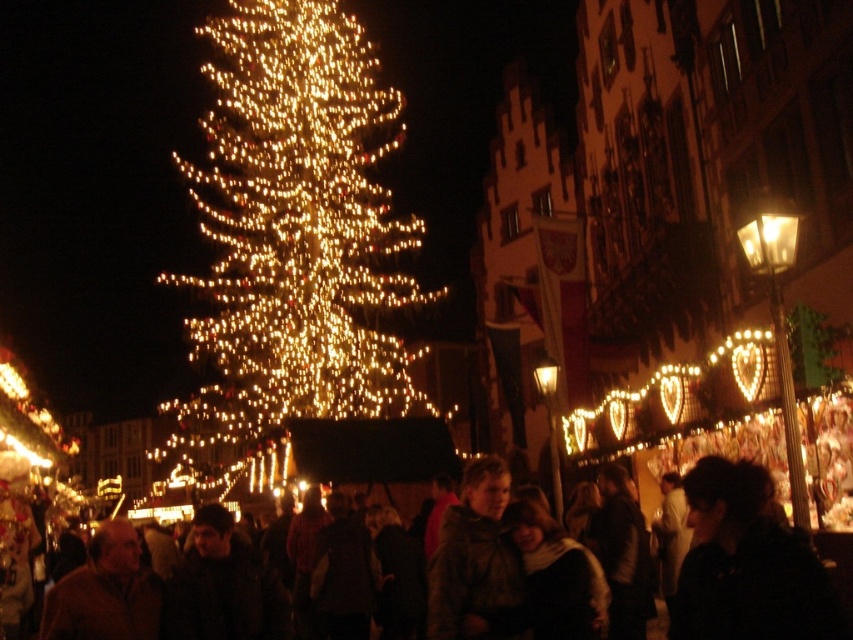
You are a vendor at the Christmas market and want to hang a new decoration on the illuminated plastic tree at center. To do this, you need to step around the dark brown leather jacket at lower center. Is the jacket in your way when approaching the tree from the front?

The dark brown leather jacket at lower center is behind the illuminated plastic tree at center, so it is not blocking the front of the tree. You can approach the tree from the front without needing to step around the jacket.

You are a vendor at the Christmas market and need to hang a decoration that requires reaching the top of the illuminated plastic tree at center. Considering the height of the dark brown leather jacket at lower center, can you estimate whether the tree is tall enough to require a ladder?

The illuminated plastic tree at center is taller than the dark brown leather jacket at lower center, so it is likely that the tree is tall enough to require a ladder to reach its top.